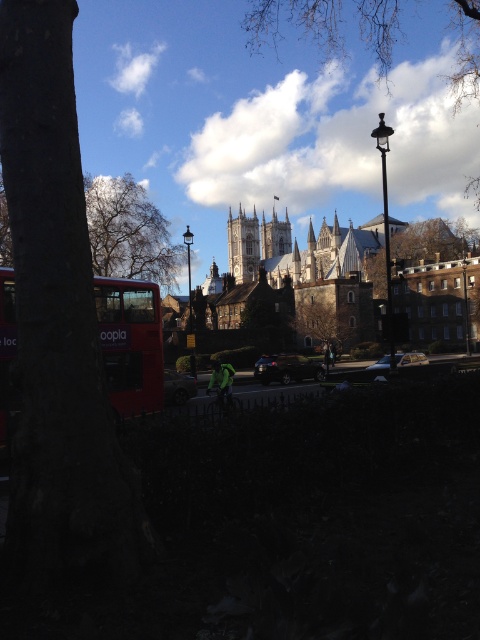
Does bare branches at left have a lesser width compared to metallic silver car at center?

Incorrect, bare branches at left's width is not less than metallic silver car at center's.

Who is lower down, bare branches at left or metallic silver car at center?

Positioned lower is metallic silver car at center.

Locate an element on the screen. The width and height of the screenshot is (480, 640). bare branches at left is located at coordinates (129, 230).

Can you confirm if stone gothic cathedral at center is positioned above metallic silver car at center?

Yes, stone gothic cathedral at center is above metallic silver car at center.

Image resolution: width=480 pixels, height=640 pixels. In order to click on stone gothic cathedral at center in this screenshot , I will do `click(242, 244)`.

Does green leafy tree at center have a larger size compared to metallic silver car at center?

Correct, green leafy tree at center is larger in size than metallic silver car at center.

Who is taller, green leafy tree at center or metallic silver car at center?

With more height is green leafy tree at center.

At what (x,y) coordinates should I click in order to perform the action: click on green leafy tree at center. Please return your answer as a coordinate pair (x, y). This screenshot has width=480, height=640. Looking at the image, I should click on (325, 321).